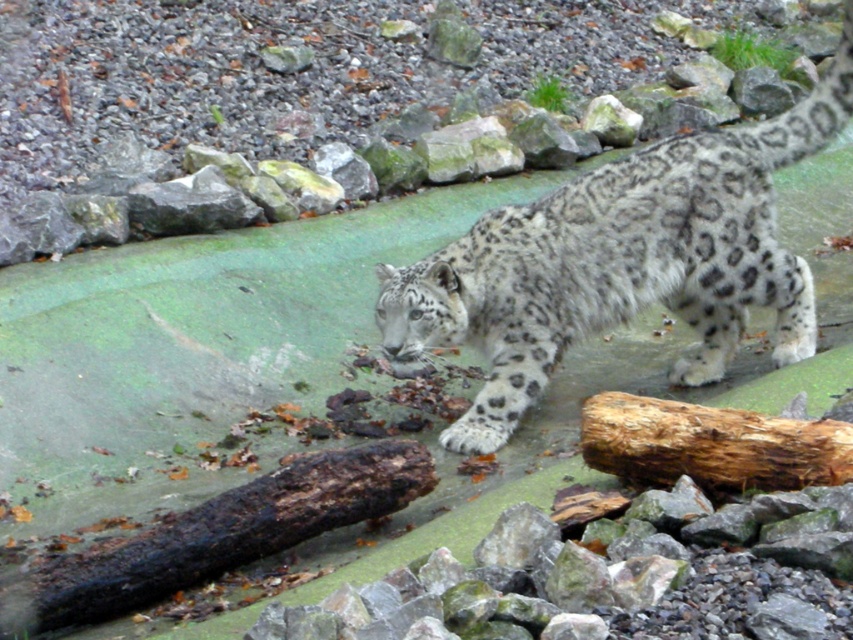
Question: Is snowy fur snow leopard at center wider than charcoal-brown wood at lower left?

Choices:
 (A) no
 (B) yes

Answer: (B)

Question: Which of the following is the farthest from the observer?

Choices:
 (A) snowy fur snow leopard at center
 (B) rough brown log at lower right
 (C) charcoal-brown wood at lower left

Answer: (A)

Question: Which object is closer to the camera taking this photo?

Choices:
 (A) charcoal-brown wood at lower left
 (B) rough brown log at lower right

Answer: (B)

Question: Which point is closer to the camera?

Choices:
 (A) (677, 243)
 (B) (248, 536)

Answer: (B)

Question: Observing the image, what is the correct spatial positioning of charcoal-brown wood at lower left in reference to rough brown log at lower right?

Choices:
 (A) below
 (B) above

Answer: (A)

Question: Does snowy fur snow leopard at center appear on the left side of charcoal-brown wood at lower left?

Choices:
 (A) no
 (B) yes

Answer: (A)